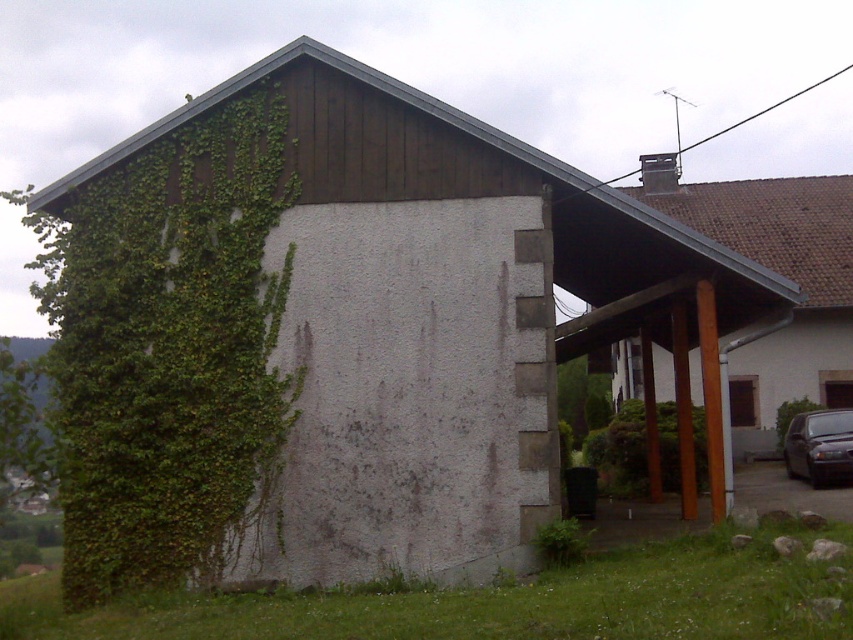
Image resolution: width=853 pixels, height=640 pixels. Find the location of `brown wood carport at upper right`. brown wood carport at upper right is located at coordinates (781, 275).

Between brown wood carport at upper right and metallic gray sedan at lower right, which one is positioned higher?

Positioned higher is brown wood carport at upper right.

Locate an element on the screen. brown wood carport at upper right is located at coordinates (781, 275).

Does green ivy at upper left appear on the left side of brown wood carport at upper right?

Yes, green ivy at upper left is to the left of brown wood carport at upper right.

Which of these two, green ivy at upper left or brown wood carport at upper right, stands taller?

With more height is brown wood carport at upper right.

The height and width of the screenshot is (640, 853). In order to click on green ivy at upper left in this screenshot , I will do `click(171, 353)`.

Describe the element at coordinates (171, 353) in the screenshot. The image size is (853, 640). I see `green ivy at upper left` at that location.

Between point (137, 424) and point (820, 452), which one is positioned behind?

Point (820, 452)

Between point (236, 280) and point (838, 440), which one is positioned in front?

Point (236, 280) is more forward.

Locate an element on the screen. green ivy at upper left is located at coordinates 171,353.